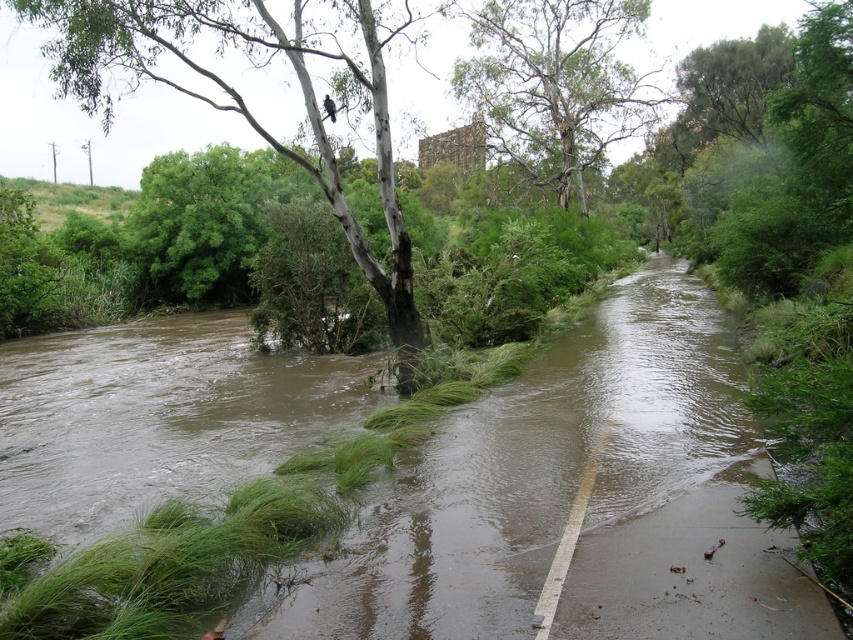
Is the position of green leafy tree at left more distant than that of green rough bark tree at upper center?

No.

Looking at this image, is green leafy tree at left thinner than green rough bark tree at upper center?

No, green leafy tree at left is not thinner than green rough bark tree at upper center.

The image size is (853, 640). What are the coordinates of `green leafy tree at left` in the screenshot? It's located at (244, 99).